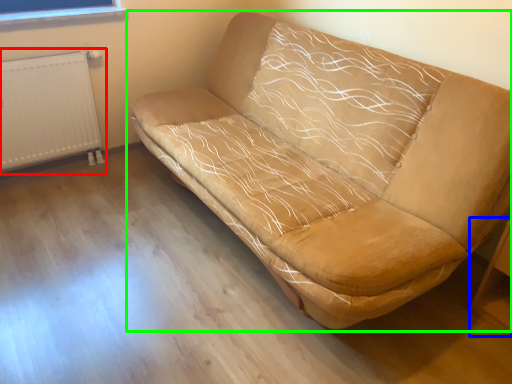
Question: Estimate the real-world distances between objects in this image. Which object is closer to radiator (highlighted by a red box), table (highlighted by a blue box) or studio couch (highlighted by a green box)?

Choices:
 (A) table
 (B) studio couch

Answer: (B)